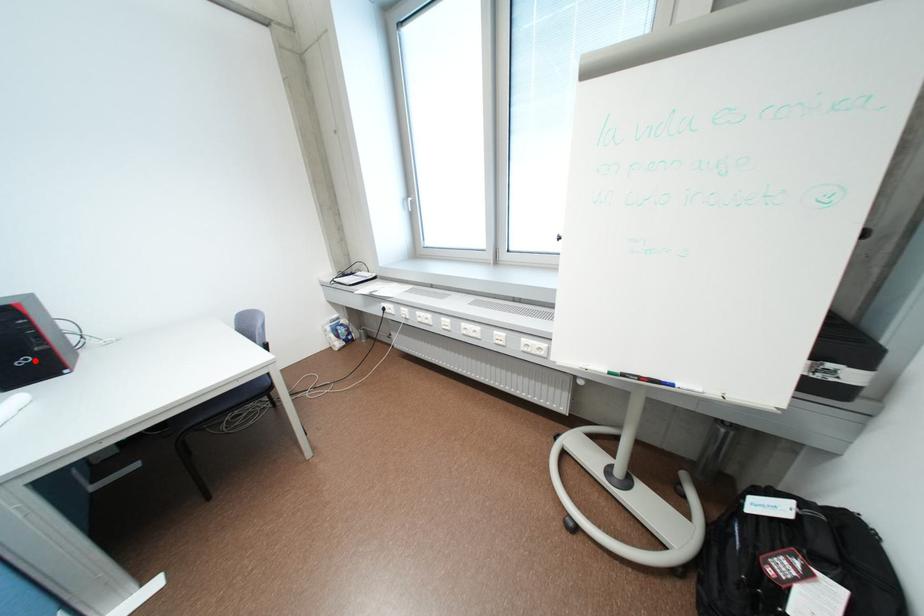
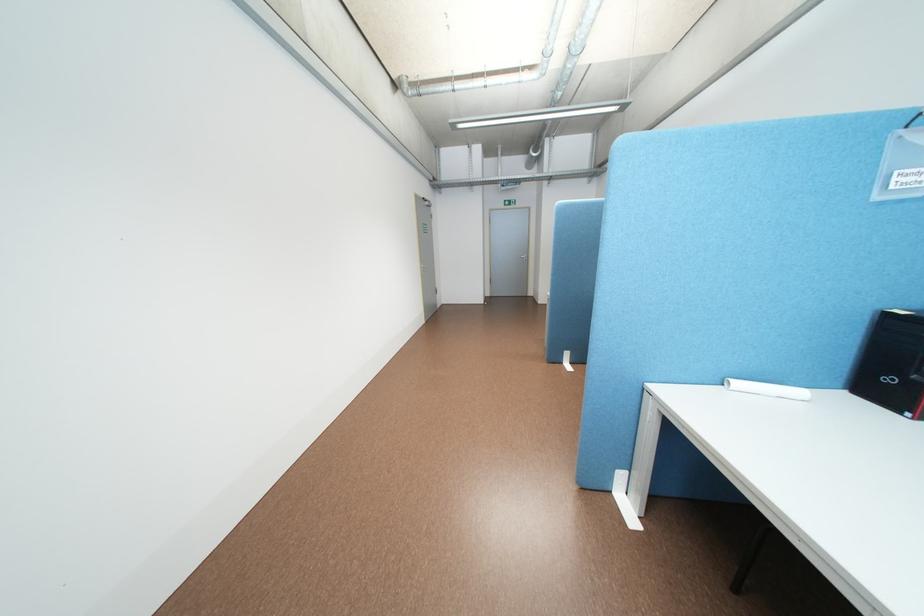
Find the pixel in the second image that matches the highlighted location in the first image.

(901, 379)